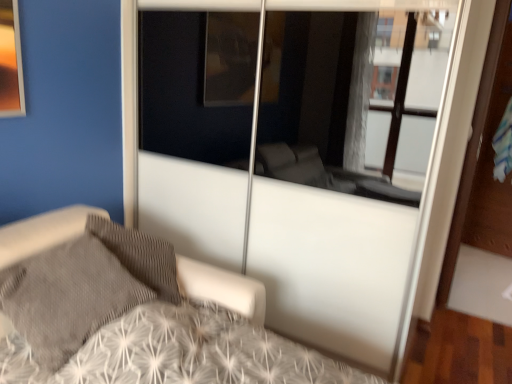
Find the location of a particular element. This screenshot has width=512, height=384. white textured bed at center is located at coordinates (135, 313).

This screenshot has width=512, height=384. What do you see at coordinates (135, 313) in the screenshot? I see `white textured bed at center` at bounding box center [135, 313].

What is the approximate height of gray textured pillow at lower left?

gray textured pillow at lower left is 61.05 centimeters tall.

This screenshot has height=384, width=512. Identify the location of gray textured pillow at lower left. (68, 297).

The height and width of the screenshot is (384, 512). What do you see at coordinates (68, 297) in the screenshot? I see `gray textured pillow at lower left` at bounding box center [68, 297].

Locate an element on the screen. white textured bed at center is located at coordinates (135, 313).

Visually, is gray textured pillow at lower left positioned to the left or to the right of white textured bed at center?

Clearly, gray textured pillow at lower left is on the left of white textured bed at center in the image.

Which is in front, gray textured pillow at lower left or white textured bed at center?

white textured bed at center is closer to the camera.

Considering the points (67, 300) and (91, 280), which point is in front, point (67, 300) or point (91, 280)?

The point (67, 300) is more forward.

From the image's perspective, is gray textured pillow at lower left positioned above or below white textured bed at center?

Based on their image positions, gray textured pillow at lower left is located above white textured bed at center.

Based on the photo, from a real-world perspective, between gray textured pillow at lower left and white textured bed at center, who is vertically higher?

gray textured pillow at lower left, from a real-world perspective.

Which object is wider, gray textured pillow at lower left or white textured bed at center?

white textured bed at center.

Considering the relative sizes of gray textured pillow at lower left and white textured bed at center in the image provided, is gray textured pillow at lower left shorter than white textured bed at center?

Correct, gray textured pillow at lower left is not as tall as white textured bed at center.

Is gray textured pillow at lower left bigger than white textured bed at center?

No, gray textured pillow at lower left is not bigger than white textured bed at center.

Is white textured bed at center located within gray textured pillow at lower left?

No, white textured bed at center is located outside of gray textured pillow at lower left.

Are gray textured pillow at lower left and white textured bed at center located far from each other?

That's not correct — gray textured pillow at lower left is a little close to white textured bed at center.

Does gray textured pillow at lower left turn towards white textured bed at center?

Yes, gray textured pillow at lower left is aimed at white textured bed at center.

At what (x,y) coordinates should I click in order to perform the action: click on bed in front of the gray textured pillow at lower left. Please return your answer as a coordinate pair (x, y). Looking at the image, I should click on [x=135, y=313].

Considering the positions of objects white textured bed at center and gray textured pillow at lower left in the image provided, who is more to the left, white textured bed at center or gray textured pillow at lower left?

gray textured pillow at lower left.

Relative to gray textured pillow at lower left, is white textured bed at center in front or behind?

In the image, white textured bed at center appears in front of gray textured pillow at lower left.

In the scene shown: Which point is more distant from viewer, (x=24, y=365) or (x=32, y=280)?

The point (x=32, y=280) is farther.

From the image's perspective, is white textured bed at center above gray textured pillow at lower left?

No, from the image's perspective, white textured bed at center is not above gray textured pillow at lower left.

From a real-world perspective, is white textured bed at center positioned above or below gray textured pillow at lower left?

In terms of real-world spatial position, white textured bed at center is below gray textured pillow at lower left.

Based on the photo, considering the sizes of objects white textured bed at center and gray textured pillow at lower left in the image provided, who is wider, white textured bed at center or gray textured pillow at lower left?

With larger width is white textured bed at center.

Who is shorter, white textured bed at center or gray textured pillow at lower left?

With less height is gray textured pillow at lower left.

Considering the relative sizes of white textured bed at center and gray textured pillow at lower left in the image provided, is white textured bed at center smaller than gray textured pillow at lower left?

No, white textured bed at center is not smaller than gray textured pillow at lower left.

Is gray textured pillow at lower left surrounded by white textured bed at center?

Yes, gray textured pillow at lower left is a part of white textured bed at center.

Is white textured bed at center far away from gray textured pillow at lower left?

That's not correct — white textured bed at center is a little close to gray textured pillow at lower left.

Based on the photo, is white textured bed at center aimed at gray textured pillow at lower left?

No, white textured bed at center is not aimed at gray textured pillow at lower left.

Locate an element on the screen. Image resolution: width=512 pixels, height=384 pixels. pillow behind the white textured bed at center is located at coordinates (68, 297).

Find the location of `pillow above the white textured bed at center (from a real-world perspective)`. pillow above the white textured bed at center (from a real-world perspective) is located at coordinates (68, 297).

Find the location of a particular element. This screenshot has width=512, height=384. bed that appears on the right of gray textured pillow at lower left is located at coordinates (135, 313).